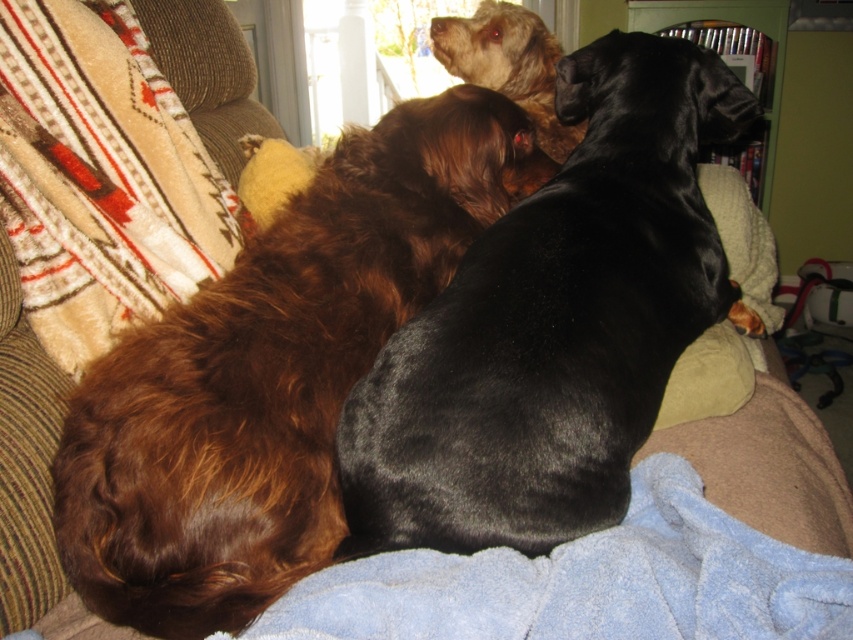
Question: Considering the real-world distances, which object is closest to the shiny black dog at center?

Choices:
 (A) blue fleece blanket at center
 (B) beige fuzzy blanket at left
 (C) light brown fur at upper center

Answer: (A)

Question: Is brown fuzzy dog at center positioned at the back of light brown fur at upper center?

Choices:
 (A) no
 (B) yes

Answer: (A)

Question: Which point is closer to the camera?

Choices:
 (A) (759, 566)
 (B) (697, 128)
 (C) (228, 368)
 (D) (569, 129)

Answer: (A)

Question: Is brown fuzzy dog at center to the right of beige fuzzy blanket at left from the viewer's perspective?

Choices:
 (A) no
 (B) yes

Answer: (B)

Question: Which object is closer to the camera taking this photo?

Choices:
 (A) light brown fur at upper center
 (B) blue fleece blanket at center
 (C) shiny black dog at center

Answer: (B)

Question: Is brown fuzzy dog at center to the right of light brown fur at upper center from the viewer's perspective?

Choices:
 (A) no
 (B) yes

Answer: (A)